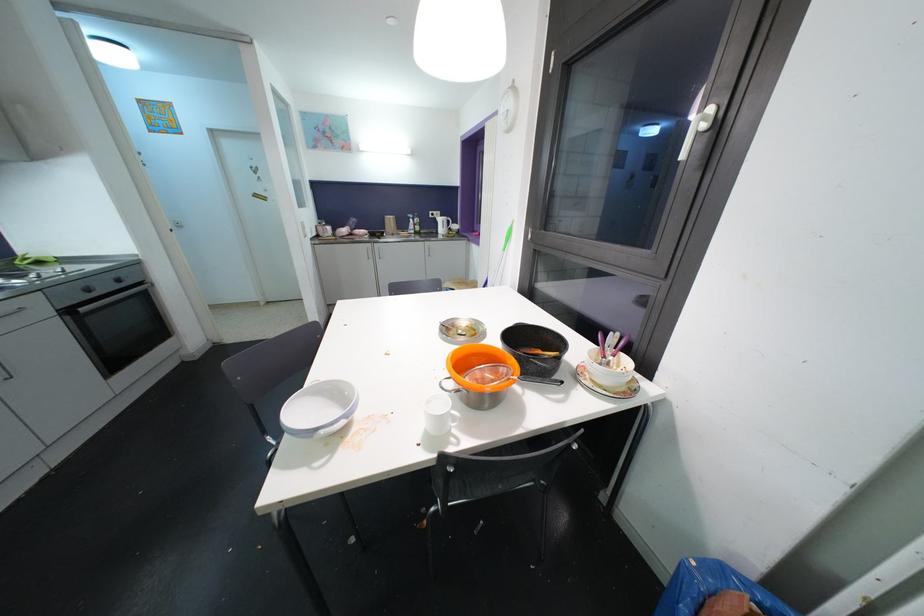
Find where to pull the oven door handle. Please return your answer as a coordinate pair (x, y).

(113, 299)